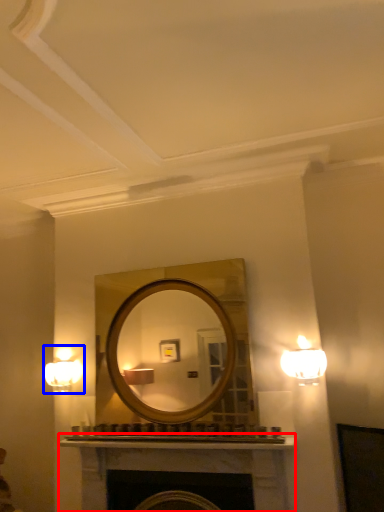
Question: Which of the following is the closest to the observer, fireplace (highlighted by a red box) or fixture (highlighted by a blue box)?

Choices:
 (A) fireplace
 (B) fixture

Answer: (A)